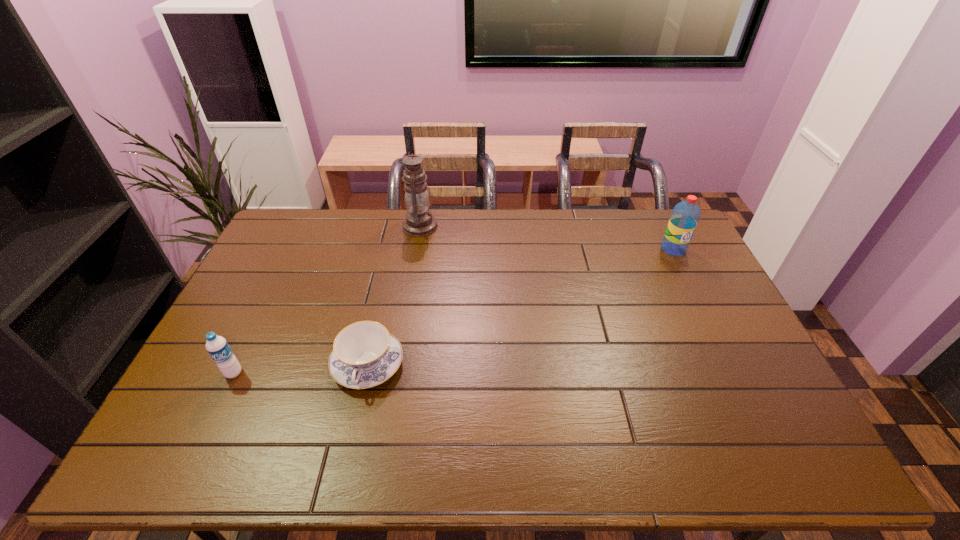
You are a GUI agent. You are given a task and a screenshot of the screen. Output one action in this format:
    pyautogui.click(x=<x>, y=<y>)
    Task: Click on the empty space between the third tallest object and the shortest object
    
    Given the screenshot: What is the action you would take?
    pyautogui.click(x=300, y=369)

Locate an element on the screen. This screenshot has width=960, height=540. free space between the rightmost object and the leftmost object is located at coordinates (453, 311).

The image size is (960, 540). I want to click on object that stands as the closest to the nearer water bottle, so click(x=365, y=354).

Locate an element on the screen. object that can be found as the third closest to the chinaware is located at coordinates (685, 216).